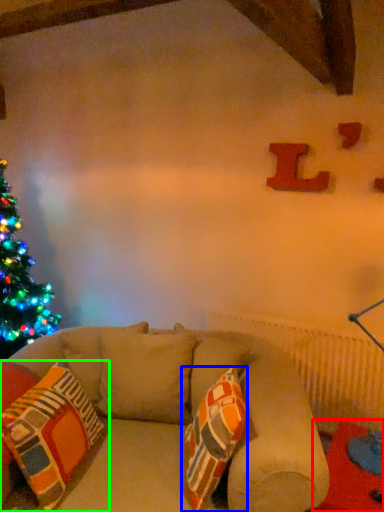
Question: Which object is the farthest from table (highlighted by a red box)? Choose among these: throw pillow (highlighted by a blue box) or pillow (highlighted by a green box).

Choices:
 (A) throw pillow
 (B) pillow

Answer: (B)